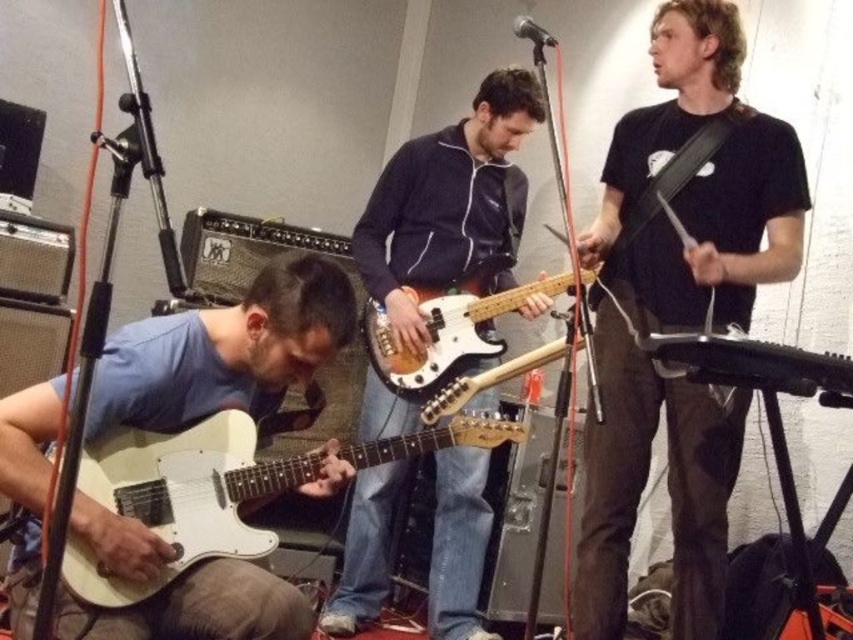
You are a GUI agent. You are given a task and a screenshot of the screen. Output one action in this format:
    pyautogui.click(x=<x>, y=<y>)
    Task: Click on the white matte guitar at lower left
    The image size is (853, 640).
    Given the screenshot: What is the action you would take?
    click(x=224, y=349)

Who is positioned more to the right, white matte guitar at lower left or wooden electric bass at center?

wooden electric bass at center is more to the right.

Between point (138, 333) and point (407, 380), which one is positioned in front?

Point (138, 333)

Where is `white matte guitar at lower left`? The image size is (853, 640). white matte guitar at lower left is located at coordinates (224, 349).

Locate an element on the screen. black matte guitar at center is located at coordinates (699, 184).

Which is more to the right, black matte guitar at center or white matte guitar at lower left?

Positioned to the right is black matte guitar at center.

Locate an element on the screen. black matte guitar at center is located at coordinates (699, 184).

Based on the photo, can you confirm if black matte guitar at center is smaller than white matte electric guitar at lower left?

Incorrect, black matte guitar at center is not smaller in size than white matte electric guitar at lower left.

Based on the photo, who is higher up, black matte guitar at center or white matte electric guitar at lower left?

black matte guitar at center is higher up.

Does point (654, 40) come closer to viewer compared to point (236, 516)?

No, (654, 40) is behind (236, 516).

Where is `black matte guitar at center`? black matte guitar at center is located at coordinates (699, 184).